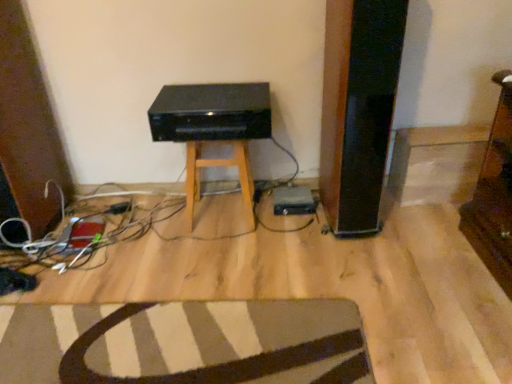
The image size is (512, 384). What are the coordinates of `empty space that is ontop of striped fabric rug at lower center (from a real-world perspective)` in the screenshot? It's located at (170, 343).